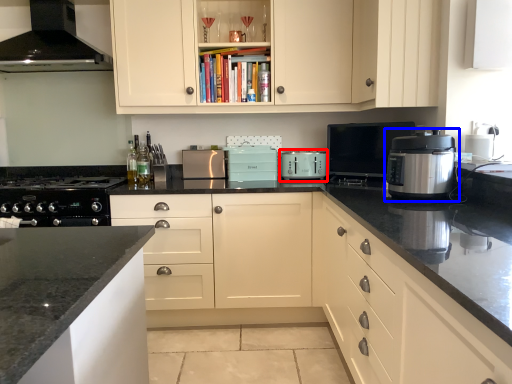
Question: Among these objects, which one is nearest to the camera, kitchen appliance (highlighted by a red box) or kitchen appliance (highlighted by a blue box)?

Choices:
 (A) kitchen appliance
 (B) kitchen appliance

Answer: (B)